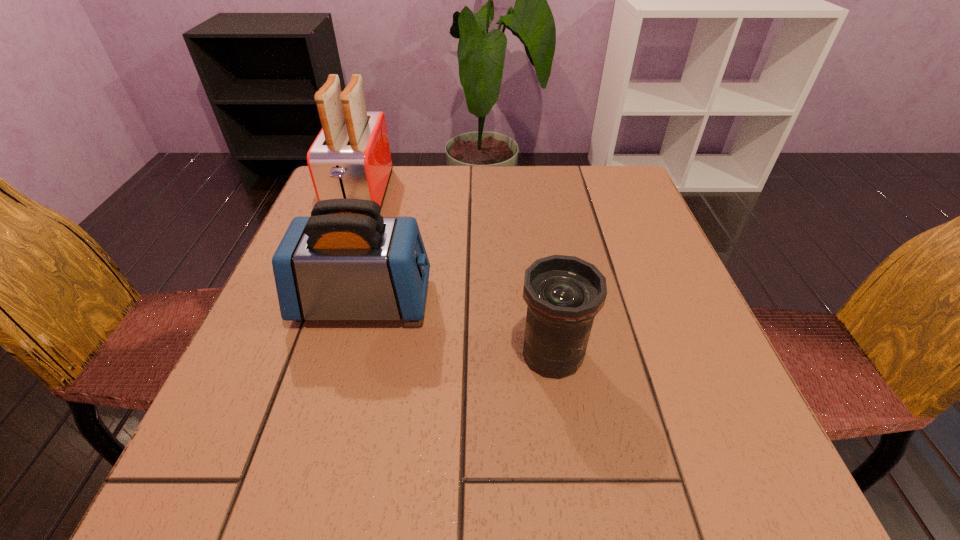
At what (x,y) coordinates should I click in order to perform the action: click on object that is at the far left corner. Please return your answer as a coordinate pair (x, y). Looking at the image, I should click on (350, 158).

The image size is (960, 540). In the image, there is a desktop. Find the location of `free region at the far edge`. free region at the far edge is located at coordinates click(410, 193).

Where is `blank space at the near edge of the desktop`? This screenshot has height=540, width=960. blank space at the near edge of the desktop is located at coordinates (474, 462).

Identify the location of vacant space at the left edge of the desktop. The image size is (960, 540). coord(253,379).

Find the location of a particular element. free region at the right edge is located at coordinates (653, 246).

Image resolution: width=960 pixels, height=540 pixels. Identify the location of vacant region at the far right corner of the desktop. (585, 190).

What are the coordinates of `vacant space at the near right corner of the desktop` in the screenshot? It's located at (676, 473).

You are a GUI agent. You are given a task and a screenshot of the screen. Output one action in this format:
    pyautogui.click(x=<x>, y=<y>)
    Task: Click on the unoccupied area between the taller toaster and the shortest object
    This screenshot has height=540, width=960.
    Given the screenshot: What is the action you would take?
    pyautogui.click(x=456, y=275)

At what (x,y) coordinates should I click in order to perform the action: click on empty location between the shortest object and the second shortest object. Please return your answer as a coordinate pair (x, y). This screenshot has width=960, height=540. Looking at the image, I should click on (458, 327).

Identify the location of free space between the farthest object and the shortest object. (456, 275).